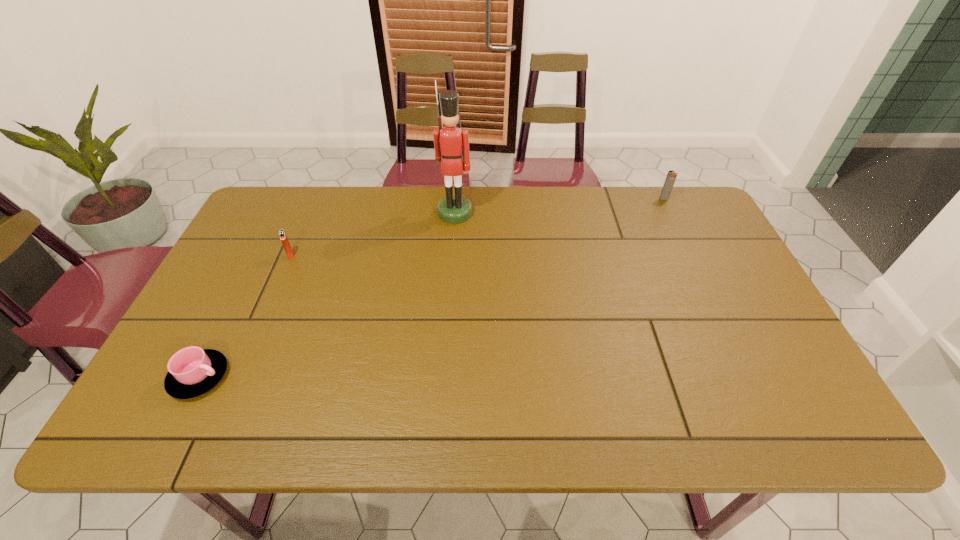
What are the coordinates of `free space between the tallest object and the rightmost object` in the screenshot? It's located at point(560,206).

Where is `free point between the shortest object and the rightmost object`? This screenshot has width=960, height=540. free point between the shortest object and the rightmost object is located at coordinates (432, 288).

Locate an element on the screen. The height and width of the screenshot is (540, 960). vacant area that lies between the tallest object and the second object from left to right is located at coordinates (372, 234).

Where is `object identified as the closest to the shortest object`? This screenshot has height=540, width=960. object identified as the closest to the shortest object is located at coordinates (282, 234).

Identify which object is the third nearest to the leftmost object. Please provide its 2D coordinates. Your answer should be formatted as a tuple, i.e. [(x, y)], where the tuple contains the x and y coordinates of a point satisfying the conditions above.

[(669, 182)]

Identify the location of vacant area that satisfies the following two spatial constraints: 1. on the back side of the second object from left to right; 2. on the right side of the farther igniter. The width and height of the screenshot is (960, 540). (316, 199).

This screenshot has width=960, height=540. Identify the location of free location that satisfies the following two spatial constraints: 1. on the front-facing side of the tallest object; 2. on the side with the handle of the shortest object. (444, 376).

Image resolution: width=960 pixels, height=540 pixels. In order to click on free spot that satisfies the following two spatial constraints: 1. on the front-facing side of the second farthest object; 2. on the side with the handle of the cup in this screenshot , I will do `click(444, 376)`.

You are a GUI agent. You are given a task and a screenshot of the screen. Output one action in this format:
    pyautogui.click(x=<x>, y=<y>)
    Task: Click on the free space that satisfies the following two spatial constraints: 1. on the front side of the farther igniter; 2. on the side with the handle of the leftmost object
    
    Given the screenshot: What is the action you would take?
    pyautogui.click(x=751, y=376)

Where is `free space that satisfies the following two spatial constraints: 1. on the front-facing side of the third object from left to right; 2. on the side with the handle of the leftmost object`? Image resolution: width=960 pixels, height=540 pixels. free space that satisfies the following two spatial constraints: 1. on the front-facing side of the third object from left to right; 2. on the side with the handle of the leftmost object is located at coordinates (444, 376).